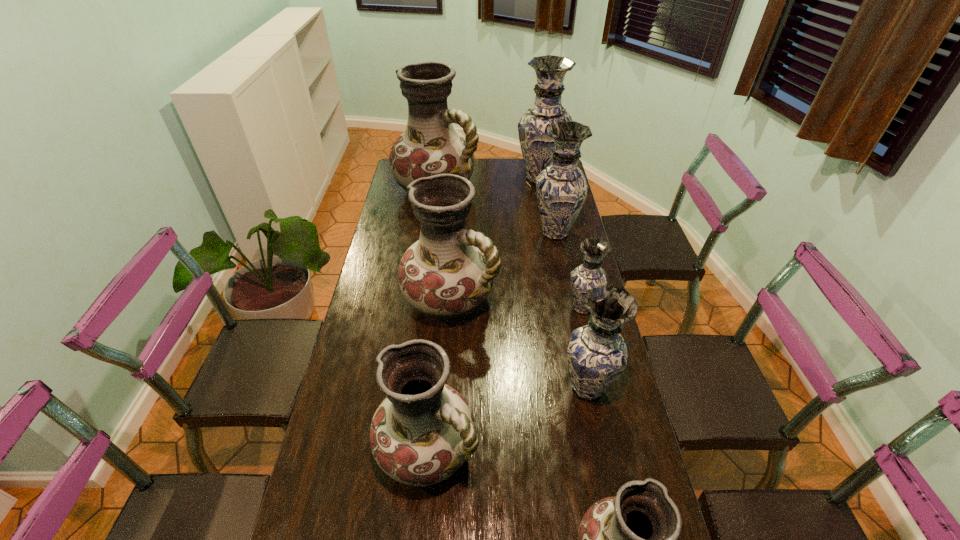
You are a GUI agent. You are given a task and a screenshot of the screen. Output one action in this format:
    pyautogui.click(x=<x>, y=<y>)
    Task: Click on the farthest red vase
    
    Given the screenshot: What is the action you would take?
    pyautogui.click(x=430, y=145)

Where is `the biggest blue vase`? The height and width of the screenshot is (540, 960). the biggest blue vase is located at coordinates (536, 145).

The height and width of the screenshot is (540, 960). Identify the location of the second farthest red vase. (448, 273).

Where is `the third farthest object`? This screenshot has height=540, width=960. the third farthest object is located at coordinates (561, 188).

Identify the location of the third nearest blue vase. (561, 188).

Image resolution: width=960 pixels, height=540 pixels. What are the coordinates of `the second smallest red vase` in the screenshot? It's located at [422, 432].

Where is `the third biggest blue vase`? The height and width of the screenshot is (540, 960). the third biggest blue vase is located at coordinates (597, 354).

At what (x,y) coordinates should I click in order to perform the action: click on the second nearest blue vase. Please return your answer as a coordinate pair (x, y). Image resolution: width=960 pixels, height=540 pixels. Looking at the image, I should click on (589, 275).

Image resolution: width=960 pixels, height=540 pixels. I want to click on vacant space situated 0.370m on the front of the farthest red vase, so click(426, 268).

Locate an element on the screen. The height and width of the screenshot is (540, 960). vacant area situated on the front of the biggest blue vase is located at coordinates (551, 237).